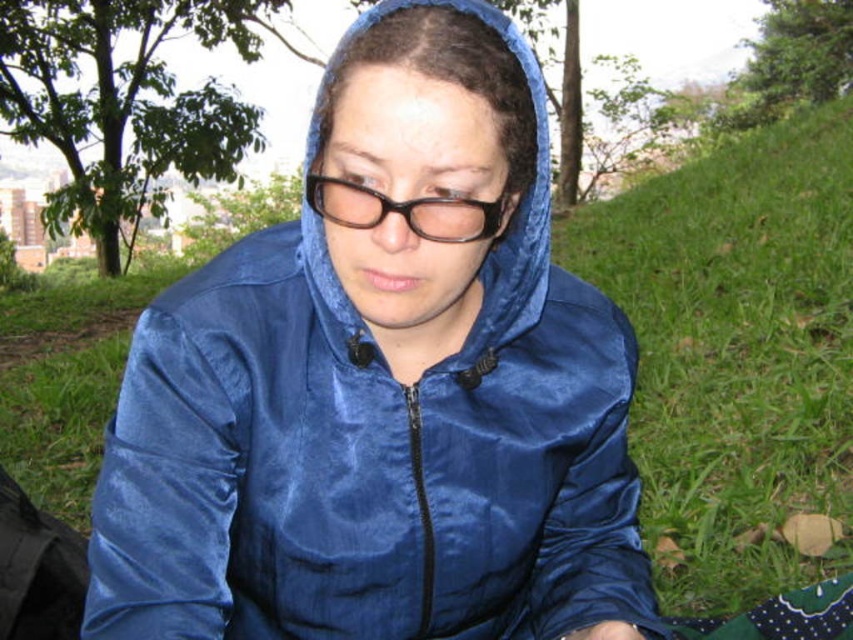
Question: Estimate the real-world distances between objects in this image. Which object is closer to the green grass at lower right?

Choices:
 (A) black plastic glasses at center
 (B) satin blue jacket at center

Answer: (B)

Question: Considering the real-world distances, which object is farthest from the black plastic glasses at center?

Choices:
 (A) satin blue jacket at center
 (B) blue fabric hood at center
 (C) green grass at lower right

Answer: (C)

Question: Which object is positioned farthest from the blue fabric hood at center?

Choices:
 (A) green grass at lower right
 (B) satin blue jacket at center
 (C) black plastic glasses at center

Answer: (A)

Question: Is green grass at lower right to the right of black plastic glasses at center from the viewer's perspective?

Choices:
 (A) yes
 (B) no

Answer: (A)

Question: Is satin blue jacket at center above black plastic glasses at center?

Choices:
 (A) yes
 (B) no

Answer: (B)

Question: Can you confirm if blue fabric hood at center is positioned below black plastic glasses at center?

Choices:
 (A) no
 (B) yes

Answer: (B)